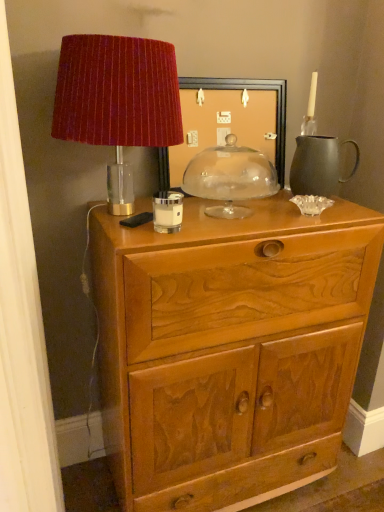
Find the location of a particular element. vacant space underneath velvet red lampshade at upper left (from a real-world perspective) is located at coordinates (x=131, y=208).